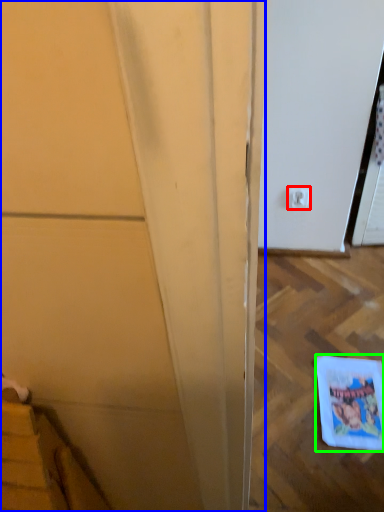
Question: Estimate the real-world distances between objects in this image. Which object is farther from electric outlet (highlighted by a red box), door (highlighted by a blue box) or comic book (highlighted by a green box)?

Choices:
 (A) door
 (B) comic book

Answer: (A)